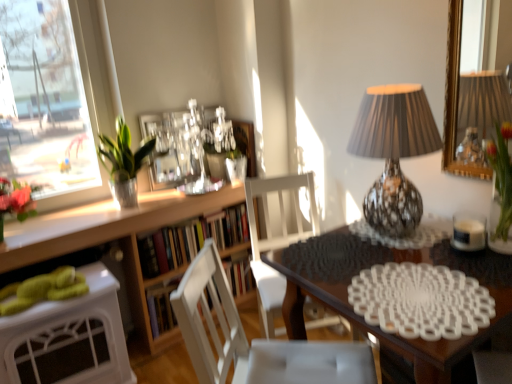
The height and width of the screenshot is (384, 512). In order to click on free space to the back side of white glass candle at right in this screenshot , I will do `click(433, 230)`.